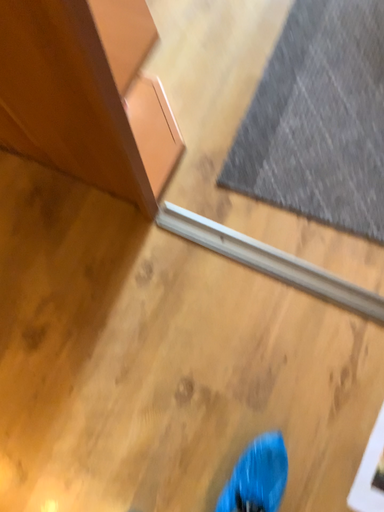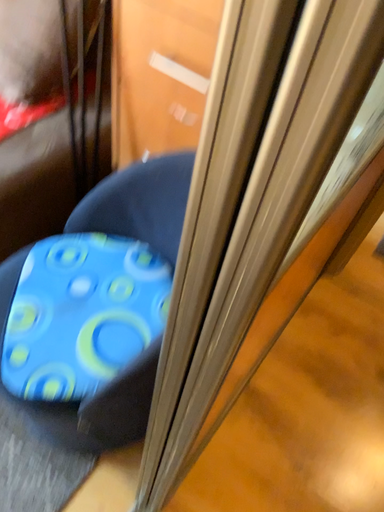
Question: Which way did the camera rotate in the video?

Choices:
 (A) rotated right
 (B) rotated left

Answer: (A)